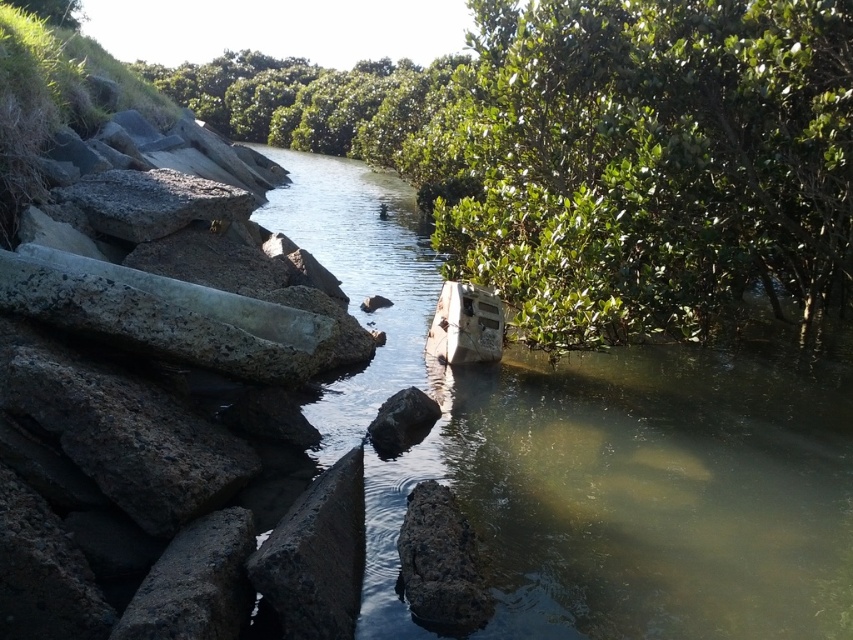
Question: Which of the following is the farthest from the observer?

Choices:
 (A) (132, 196)
 (B) (461, 616)
 (C) (384, 115)
 (D) (563, 273)

Answer: (C)

Question: Does green leafy tree at upper center have a larger size compared to dark gray concrete at lower left?

Choices:
 (A) no
 (B) yes

Answer: (B)

Question: Which of the following is the farthest from the observer?

Choices:
 (A) rusty metal boat at center
 (B) dark gray concrete at lower left
 (C) concrete block at center
 (D) rusty metallic rock at center

Answer: (A)

Question: Which of these objects is positioned farthest from the green leafy tree at upper center?

Choices:
 (A) rough concrete rock at left
 (B) smooth gray rock at center
 (C) gray rough stone at upper left
 (D) green leafy tree at center

Answer: (D)

Question: Is green leafy tree at upper center closer to the viewer compared to smooth gray rock at center?

Choices:
 (A) yes
 (B) no

Answer: (B)

Question: Can you confirm if green leafy tree at center is bigger than green leafy tree at upper center?

Choices:
 (A) no
 (B) yes

Answer: (A)